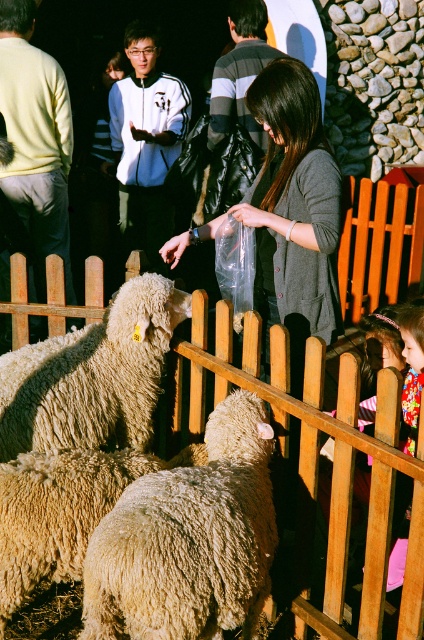
From the picture: Which of these two, fluffy woolen sheep at center or fluffy beige wool at center, stands shorter?

Standing shorter between the two is fluffy beige wool at center.

Who is more distant from viewer, (231, 476) or (77, 392)?

The point (77, 392) is more distant.

I want to click on fluffy woolen sheep at center, so click(189, 540).

Can you confirm if fluffy woolen sheep at center is smaller than gray sweater at center?

Correct, fluffy woolen sheep at center occupies less space than gray sweater at center.

Is fluffy woolen sheep at center thinner than gray sweater at center?

Correct, fluffy woolen sheep at center's width is less than gray sweater at center's.

Is point (181, 483) closer to camera compared to point (318, 196)?

Yes, it is in front of point (318, 196).

Where is `fluffy woolen sheep at center`? The width and height of the screenshot is (424, 640). fluffy woolen sheep at center is located at coordinates (189, 540).

Between wooden fence at center and gray sweater at center, which one is positioned higher?

gray sweater at center is above.

Which is behind, point (281, 385) or point (273, 195)?

Positioned behind is point (273, 195).

Which is in front, point (284, 397) or point (320, 125)?

Point (284, 397)

The width and height of the screenshot is (424, 640). Find the location of `wooden fence at center`. wooden fence at center is located at coordinates (317, 460).